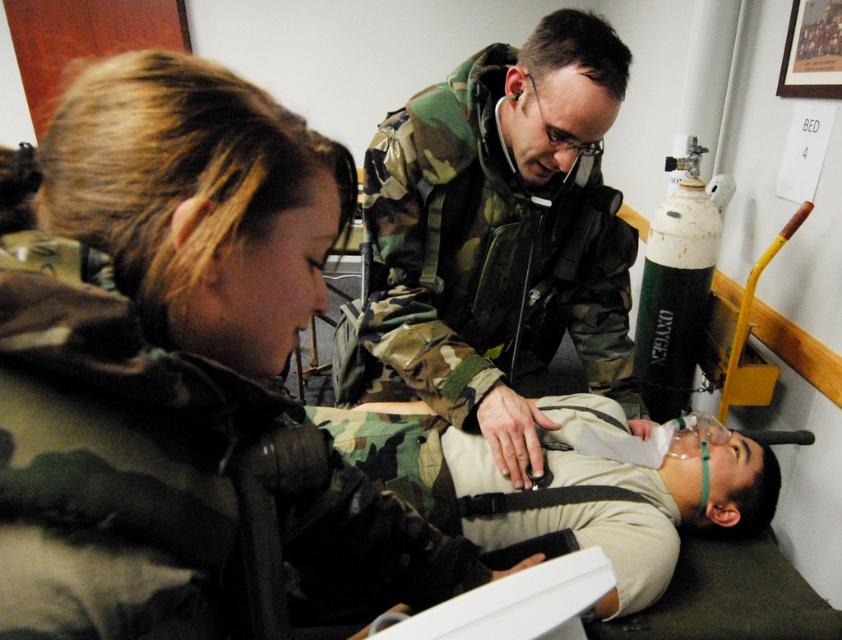
Question: Which object appears farthest from the camera in this image?

Choices:
 (A) camouflage uniform at center
 (B) white plastic tray at center
 (C) camouflage jacket at upper left

Answer: (A)

Question: Considering the relative positions of camouflage jacket at upper left and white plastic tray at center in the image provided, where is camouflage jacket at upper left located with respect to white plastic tray at center?

Choices:
 (A) left
 (B) right

Answer: (A)

Question: Among these objects, which one is nearest to the camera?

Choices:
 (A) camouflage uniform at center
 (B) camouflage jacket at upper left
 (C) white plastic tray at center

Answer: (B)

Question: Which point is farther to the camera?

Choices:
 (A) camouflage uniform at center
 (B) white plastic tray at center
 (C) camouflage jacket at upper left

Answer: (A)

Question: Is camouflage uniform at center positioned before white plastic tray at center?

Choices:
 (A) yes
 (B) no

Answer: (B)

Question: Is camouflage jacket at upper left below white plastic tray at center?

Choices:
 (A) no
 (B) yes

Answer: (A)